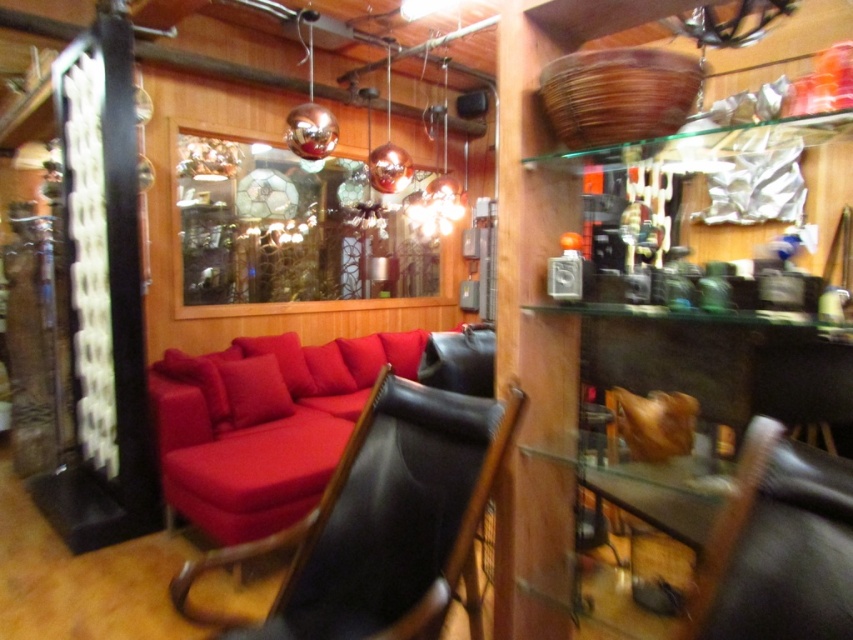
Question: Which point appears closest to the camera in this image?

Choices:
 (A) (740, 570)
 (B) (479, 385)

Answer: (A)

Question: From the image, what is the correct spatial relationship of matte red couch at center in relation to black leather chair at center?

Choices:
 (A) above
 (B) below

Answer: (B)

Question: Which point appears closest to the camera in this image?

Choices:
 (A) (828, 554)
 (B) (244, 394)

Answer: (A)

Question: Can you confirm if matte red couch at center is smaller than black leather chair at center?

Choices:
 (A) yes
 (B) no

Answer: (B)

Question: Which point is farther from the camera taking this photo?

Choices:
 (A) (271, 374)
 (B) (741, 540)

Answer: (A)

Question: Does matte red couch at center have a larger size compared to black leather chair at center?

Choices:
 (A) yes
 (B) no

Answer: (A)